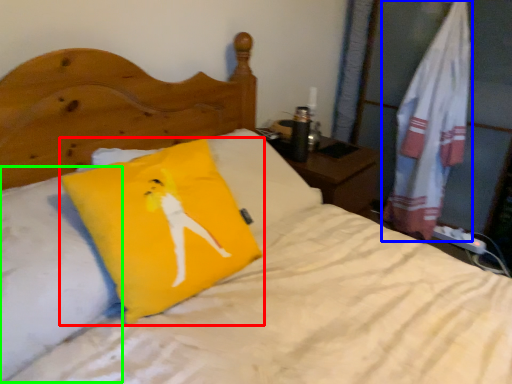
Question: Which is nearer to the pillow (highlighted by a red box)? material (highlighted by a blue box) or pillow (highlighted by a green box).

Choices:
 (A) material
 (B) pillow

Answer: (B)